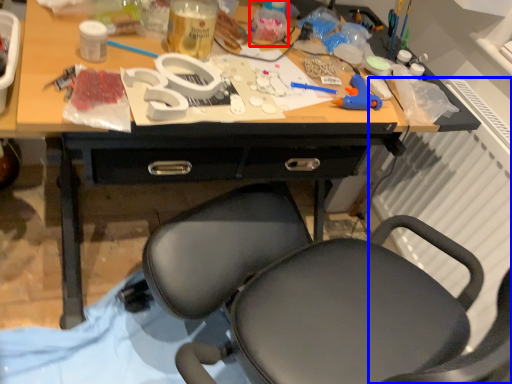
Question: Which of the following is the farthest to the observer, bottle (highlighted by a red box) or radiator (highlighted by a blue box)?

Choices:
 (A) bottle
 (B) radiator

Answer: (A)